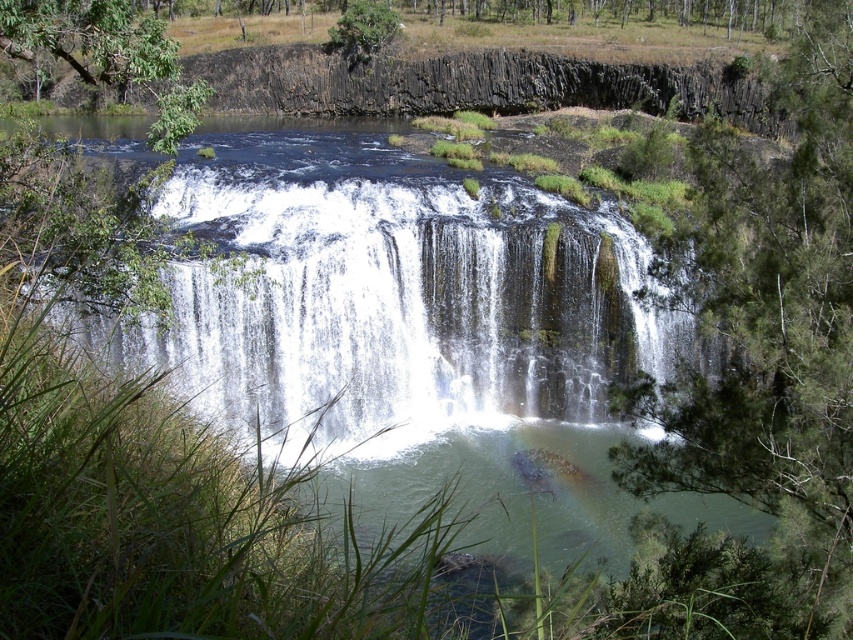
Question: Which of these objects is positioned closest to the white textured waterfall at center?

Choices:
 (A) green leafy tree at center
 (B) green rough bark tree at upper center

Answer: (A)

Question: Can you confirm if green leafy tree at upper left is positioned to the left of green rough bark tree at upper center?

Choices:
 (A) no
 (B) yes

Answer: (B)

Question: Does green leafy tree at upper left lie in front of green rough bark tree at upper center?

Choices:
 (A) yes
 (B) no

Answer: (A)

Question: Considering the real-world distances, which object is farthest from the green leafy tree at upper left?

Choices:
 (A) green leafy tree at center
 (B) white textured waterfall at center
 (C) green rough bark tree at upper center

Answer: (C)

Question: Is green leafy tree at center positioned behind green rough bark tree at upper center?

Choices:
 (A) yes
 (B) no

Answer: (B)

Question: Among these points, which one is farthest from the camera?

Choices:
 (A) (x=334, y=26)
 (B) (x=782, y=397)
 (C) (x=167, y=90)
 (D) (x=276, y=358)

Answer: (A)